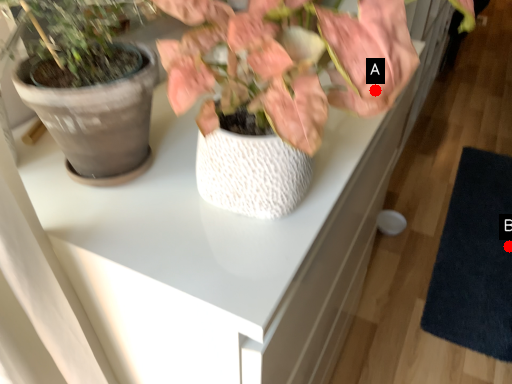
Question: Two points are circled on the image, labeled by A and B beside each circle. Which point is closer to the camera?

Choices:
 (A) A is closer
 (B) B is closer

Answer: (A)